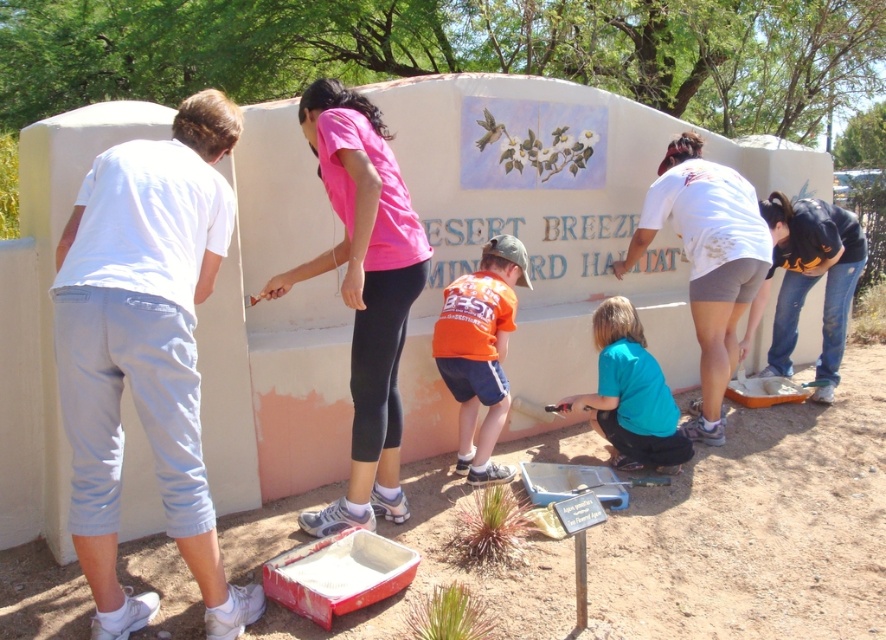
You are standing 10 feet away from the beige wall with the text and mural. You want to reach a point that is exactly 9 feet away from you. Is the point at coordinate point(187, 536) within your target distance?

The distance of point(187, 536) from viewer is 8.99 feet, so yes, it is within the target distance of 9 feet.